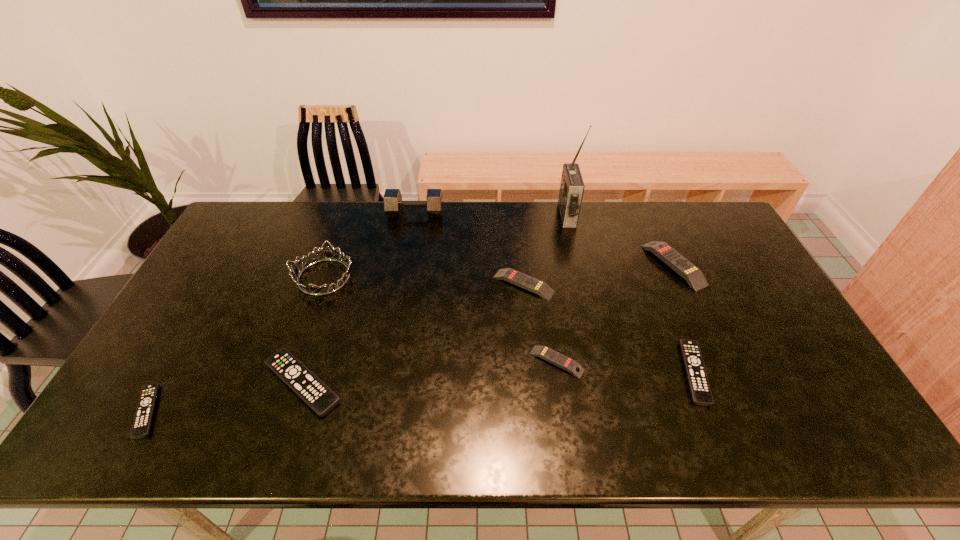
At what (x,y) coordinates should I click in order to perform the action: click on the smallest yellow remote control. Please return your answer as a coordinate pair (x, y). The width and height of the screenshot is (960, 540). Looking at the image, I should click on (556, 358).

The image size is (960, 540). In order to click on the rightmost black remote control in this screenshot , I will do `click(700, 390)`.

This screenshot has height=540, width=960. Identify the location of the leftmost remote control. (143, 417).

The width and height of the screenshot is (960, 540). Identify the location of the leftmost object. (143, 417).

Locate an element on the screen. The height and width of the screenshot is (540, 960). free location located on the display of the radio receiver is located at coordinates (458, 215).

This screenshot has width=960, height=540. I want to click on vacant region located on the display of the radio receiver, so click(x=480, y=215).

Image resolution: width=960 pixels, height=540 pixels. Identify the location of vacant region located on the display of the radio receiver. 524,215.

Image resolution: width=960 pixels, height=540 pixels. In order to click on blank area located on the left of the dumbbell in this screenshot , I will do `click(349, 213)`.

Identify the location of vacant space located 0.100m on the front-facing side of the third tallest object. (306, 327).

Find the location of a particular element. The width and height of the screenshot is (960, 540). vacant space located 0.120m on the back of the biggest yellow remote control is located at coordinates (653, 219).